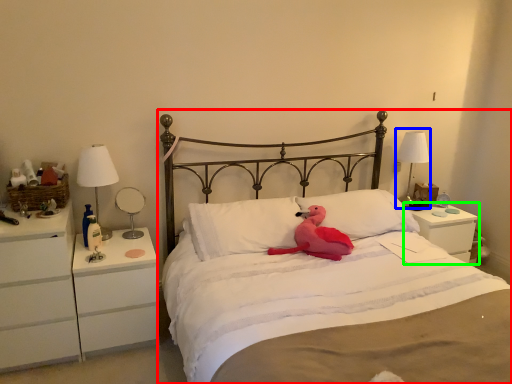
Question: Which object is positioned closest to bed (highlighted by a red box)? Select from bedside lamp (highlighted by a blue box) and nightstand (highlighted by a green box).

Choices:
 (A) bedside lamp
 (B) nightstand

Answer: (B)